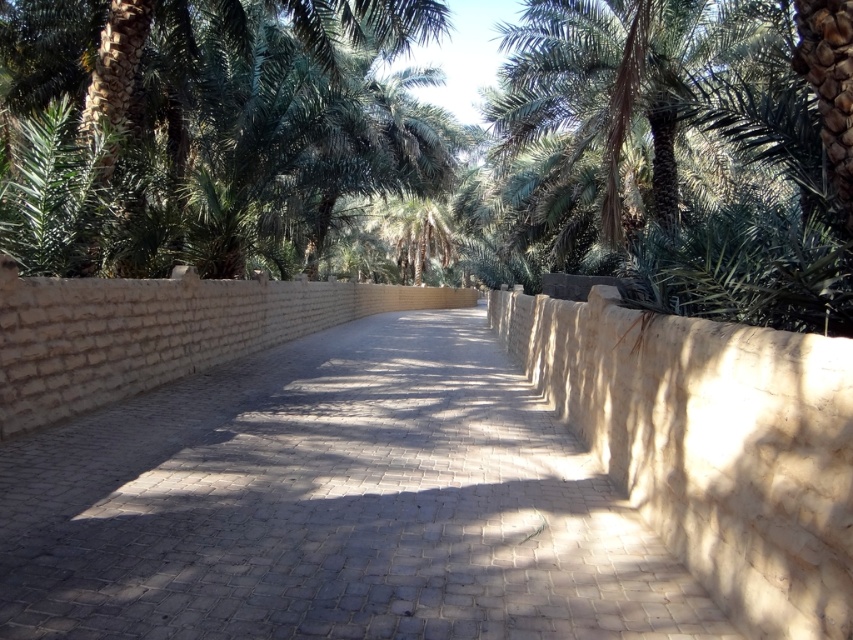
Question: Is light beige cobblestone pavement at center thinner than green leafy palm tree at upper center?

Choices:
 (A) no
 (B) yes

Answer: (A)

Question: Is light beige cobblestone pavement at center bigger than green leafy palm tree at center?

Choices:
 (A) no
 (B) yes

Answer: (A)

Question: Among these points, which one is nearest to the camera?

Choices:
 (A) (352, 444)
 (B) (683, 45)

Answer: (A)

Question: Which object is the closest to the green leafy palm tree at center?

Choices:
 (A) light beige cobblestone pavement at center
 (B) green leafy palm tree at upper center

Answer: (B)

Question: Can you confirm if light beige cobblestone pavement at center is smaller than green leafy palm tree at center?

Choices:
 (A) no
 (B) yes

Answer: (B)

Question: Which point appears closest to the camera in this image?

Choices:
 (A) (312, 209)
 (B) (486, 372)

Answer: (B)